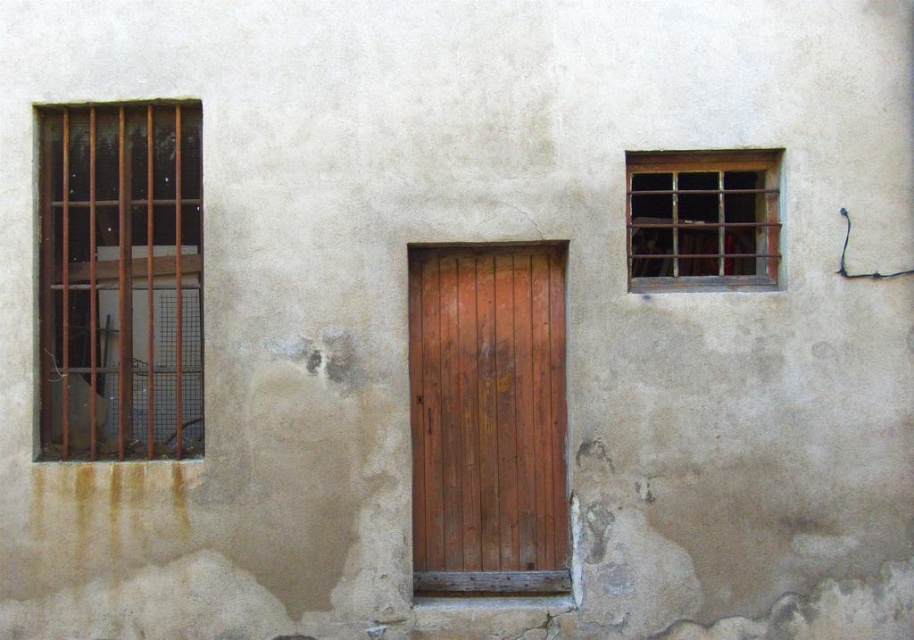
Question: Which object is positioned closest to the brown wooden bars at left?

Choices:
 (A) weathered wood door at center
 (B) rusty metal bars at upper right

Answer: (A)

Question: Which point is farther to the camera?

Choices:
 (A) tap(660, 232)
 (B) tap(469, 545)

Answer: (B)

Question: Does brown wooden bars at left come in front of weathered wood door at center?

Choices:
 (A) yes
 (B) no

Answer: (A)

Question: Is the position of weathered wood door at center more distant than that of rusty metal bars at upper right?

Choices:
 (A) yes
 (B) no

Answer: (A)

Question: Which of these objects is positioned closest to the brown wooden bars at left?

Choices:
 (A) weathered wood door at center
 (B) rusty metal bars at upper right

Answer: (A)

Question: Is brown wooden bars at left to the right of weathered wood door at center from the viewer's perspective?

Choices:
 (A) no
 (B) yes

Answer: (A)